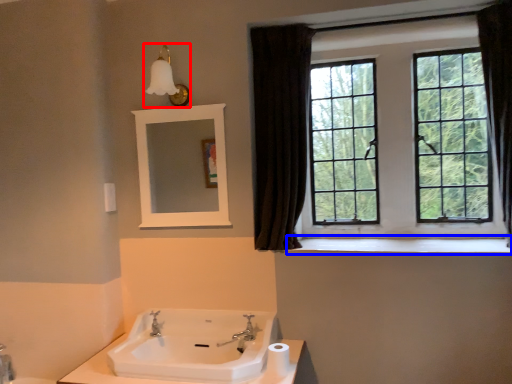
Question: Which point is further to the camera, light fixture (highlighted by a red box) or window sill (highlighted by a blue box)?

Choices:
 (A) light fixture
 (B) window sill

Answer: (A)